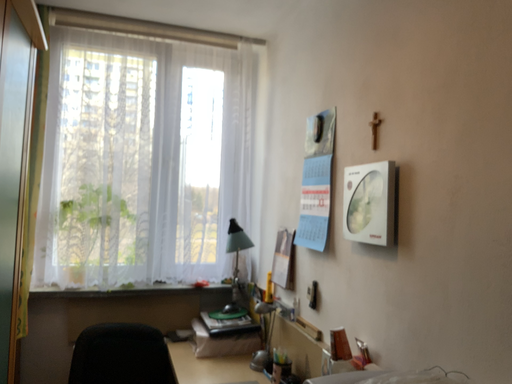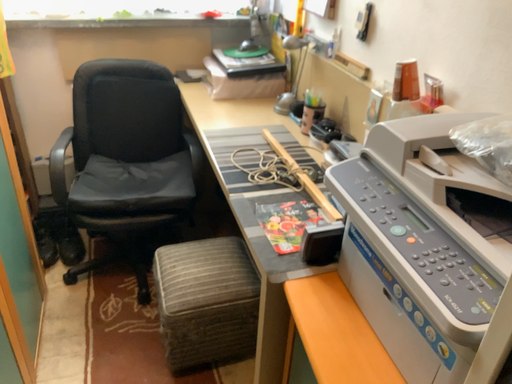
Question: Which way did the camera rotate in the video?

Choices:
 (A) rotated upward
 (B) rotated downward

Answer: (B)